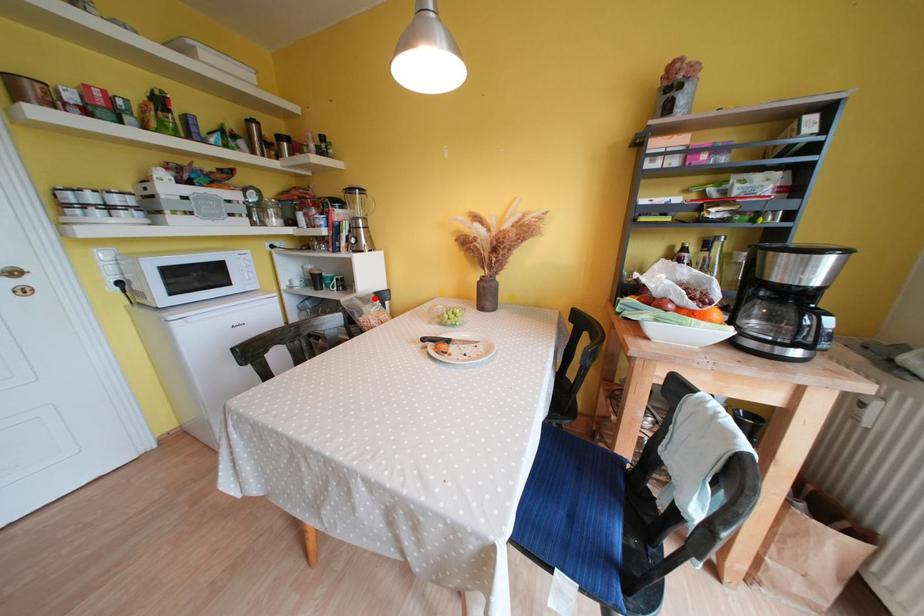
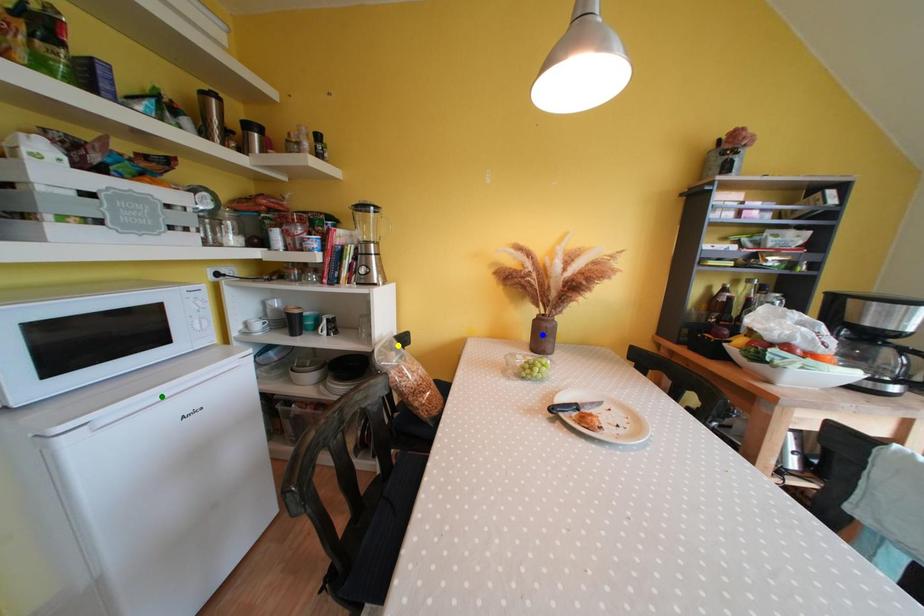
Question: I am providing you with two images of the same scene from different viewpoints. A red point is marked on the first image. You are given multiple points on the second image. In image 2, which mark is for the same physical point as the one in image 1?

Choices:
 (A) green point
 (B) blue point
 (C) yellow point

Answer: (C)